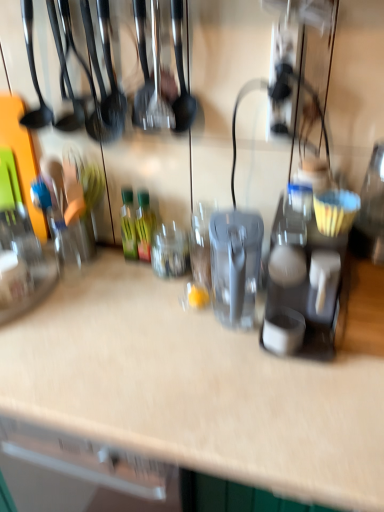
Locate an element on the screen. This screenshot has width=384, height=512. vacant area in front of green glass bottle at center, which ranks as the first bottle in right-to-left order is located at coordinates (132, 292).